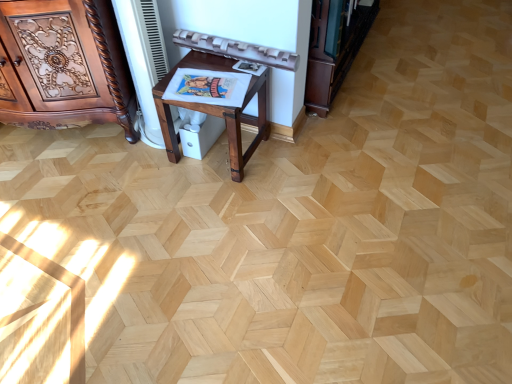
Where is `empty space that is ontop of mahogany wood table at center`? empty space that is ontop of mahogany wood table at center is located at coordinates pos(215,75).